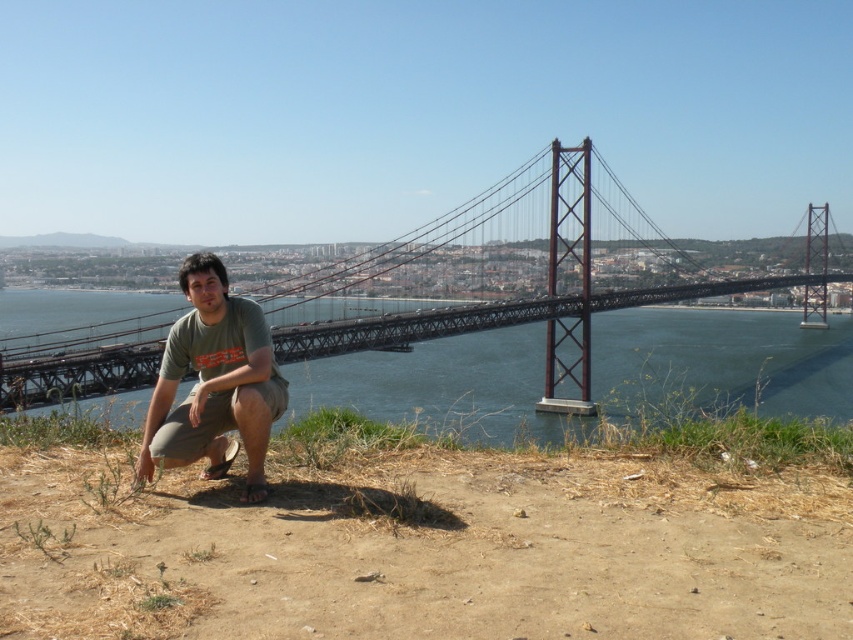
Is dark blue water at center above metallic bridge at center?

Actually, dark blue water at center is below metallic bridge at center.

Based on the photo, which is more to the left, dark blue water at center or metallic bridge at center?

Positioned to the left is dark blue water at center.

Where is `dark blue water at center`? dark blue water at center is located at coordinates (722, 360).

Does metallic bridge at center have a larger size compared to green cotton t-shirt at center?

Yes.

Which of these two, metallic bridge at center or green cotton t-shirt at center, stands taller?

Standing taller between the two is metallic bridge at center.

This screenshot has height=640, width=853. What do you see at coordinates (544, 308) in the screenshot?
I see `metallic bridge at center` at bounding box center [544, 308].

Identify the location of metallic bridge at center. Image resolution: width=853 pixels, height=640 pixels. (544, 308).

Which is below, dark blue water at center or green cotton t-shirt at center?

green cotton t-shirt at center is below.

Which is more to the left, dark blue water at center or green cotton t-shirt at center?

green cotton t-shirt at center

This screenshot has height=640, width=853. What do you see at coordinates (722, 360) in the screenshot?
I see `dark blue water at center` at bounding box center [722, 360].

Identify the location of dark blue water at center. The height and width of the screenshot is (640, 853). (722, 360).